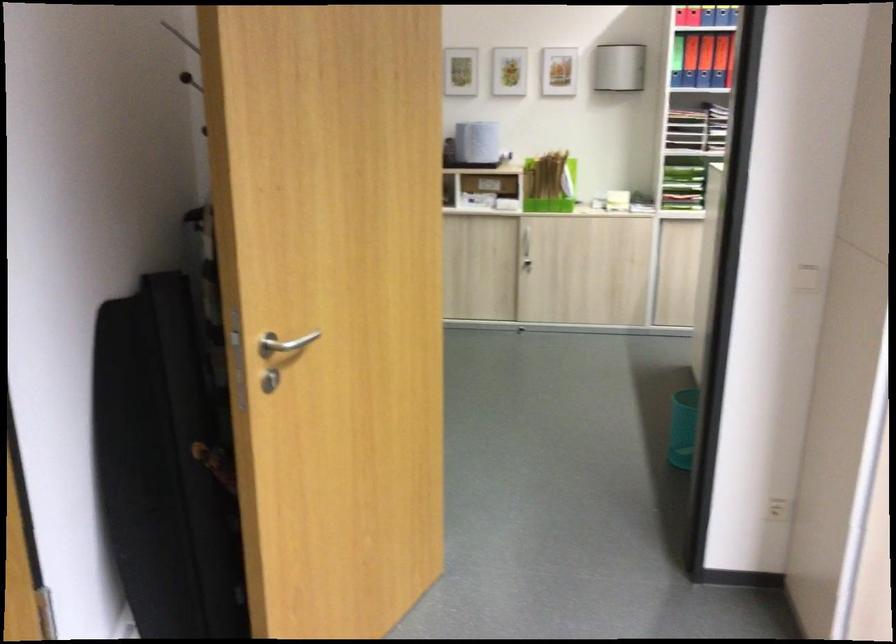
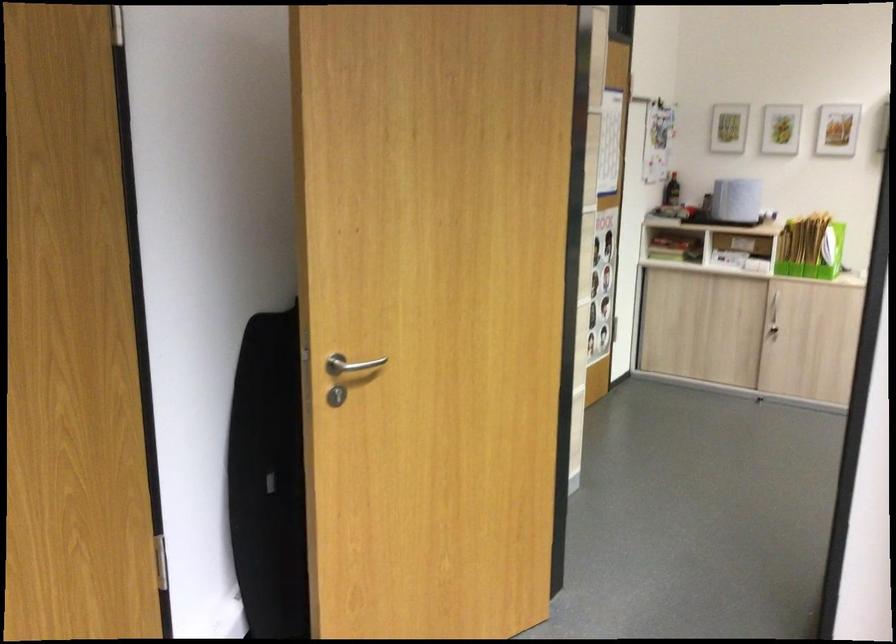
Find the pixel in the second image that matches (283,345) in the first image.

(350, 365)